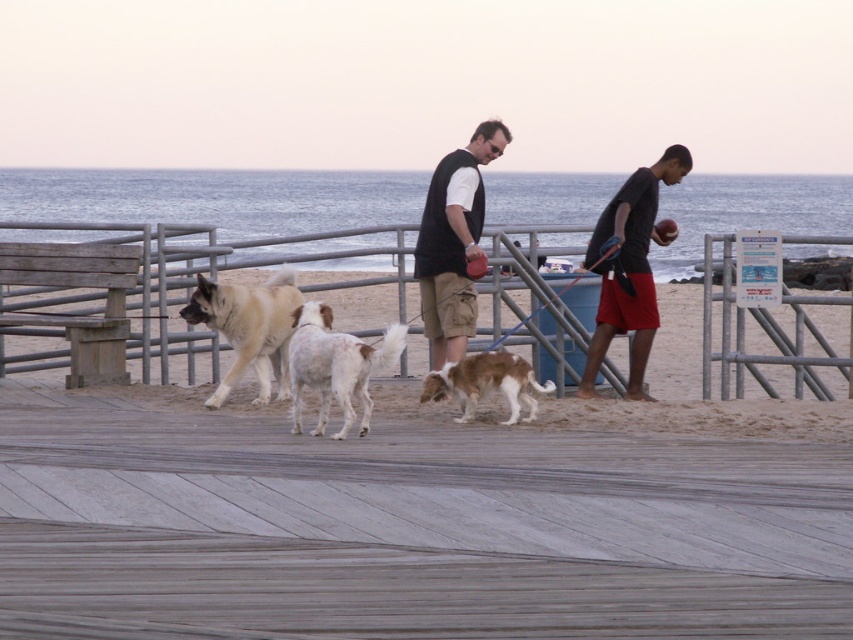
The image size is (853, 640). In order to click on black vest at center in this screenshot , I will do `click(454, 243)`.

Does black vest at center appear on the left side of brown and white fur at center?

Indeed, black vest at center is positioned on the left side of brown and white fur at center.

Looking at this image, which of these two, black vest at center or brown and white fur at center, stands taller?

Standing taller between the two is black vest at center.

This screenshot has height=640, width=853. Find the location of `black vest at center`. black vest at center is located at coordinates (454, 243).

From the picture: Is black vest at center above brown fur dog at center?

Indeed, black vest at center is positioned over brown fur dog at center.

Is black vest at center below brown fur dog at center?

No.

Is point (434, 192) more distant than point (268, 392)?

Yes, it is behind point (268, 392).

This screenshot has width=853, height=640. In order to click on black vest at center in this screenshot , I will do [x=454, y=243].